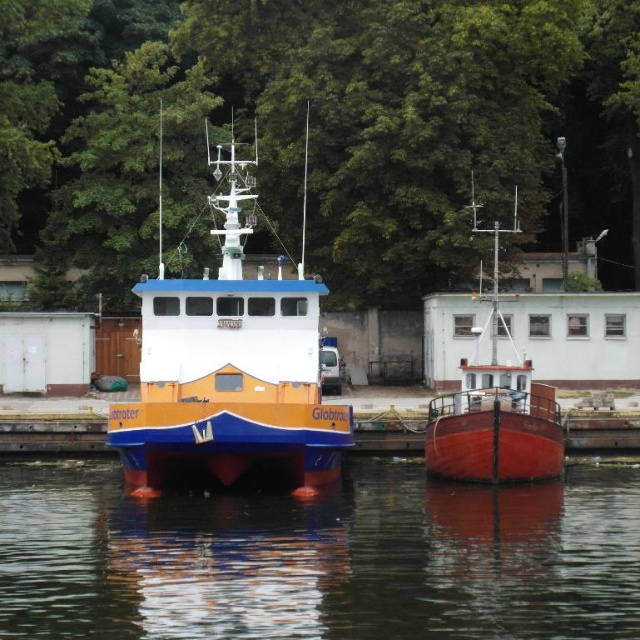
You are standing at the point marked by coordinates point (67, 524). You want to take a photo of the two boats from a distance of 40 meters. Can you move forward or backward to achieve this?

The current distance between you and the camera is 36.32 meters. To reach 40 meters, you should move backward by approximately 3.68 meters.

You are a park ranger standing at the base of the green leafy tree at upper center and need to reach the smooth red boat at center to check for safety hazards. Given that your average walking speed is 1.5 meters per second, how many seconds will it take you to walk directly to the boat?

The green leafy tree at upper center and smooth red boat at center are 12.03 meters apart. At a walking speed of 1.5 meters per second, it would take approximately 8.02 seconds to reach the boat.